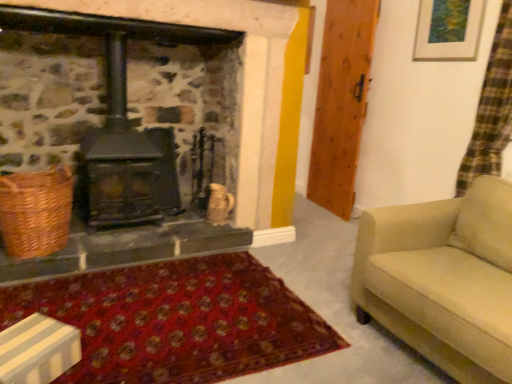
Question: Does wooden door at right have a smaller size compared to wooden picture frame at upper right?

Choices:
 (A) yes
 (B) no

Answer: (B)

Question: Does wooden door at right appear on the right side of wooden picture frame at upper right?

Choices:
 (A) yes
 (B) no

Answer: (B)

Question: Is wooden door at right turned away from wooden picture frame at upper right?

Choices:
 (A) yes
 (B) no

Answer: (B)

Question: Can you confirm if wooden door at right is shorter than wooden picture frame at upper right?

Choices:
 (A) yes
 (B) no

Answer: (B)

Question: Considering the relative sizes of wooden door at right and wooden picture frame at upper right in the image provided, is wooden door at right thinner than wooden picture frame at upper right?

Choices:
 (A) no
 (B) yes

Answer: (A)

Question: From the image's perspective, is wooden door at right located above wooden picture frame at upper right?

Choices:
 (A) yes
 (B) no

Answer: (B)

Question: Considering the relative sizes of black cast iron wood burning stove at center and wooden door at right in the image provided, is black cast iron wood burning stove at center shorter than wooden door at right?

Choices:
 (A) yes
 (B) no

Answer: (A)

Question: From a real-world perspective, does black cast iron wood burning stove at center stand above wooden door at right?

Choices:
 (A) no
 (B) yes

Answer: (A)

Question: Can you confirm if black cast iron wood burning stove at center is bigger than wooden door at right?

Choices:
 (A) no
 (B) yes

Answer: (B)

Question: Are black cast iron wood burning stove at center and wooden door at right beside each other?

Choices:
 (A) no
 (B) yes

Answer: (A)

Question: Does black cast iron wood burning stove at center have a lesser width compared to wooden door at right?

Choices:
 (A) yes
 (B) no

Answer: (B)

Question: Is black cast iron wood burning stove at center positioned before wooden door at right?

Choices:
 (A) yes
 (B) no

Answer: (A)

Question: Is beige fabric couch at right a part of wooden door at right?

Choices:
 (A) yes
 (B) no

Answer: (B)